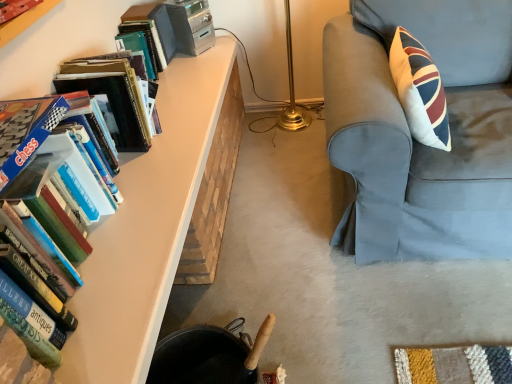
Question: Do you think hardcover books at left, positioned as the 1th book in bottom-to-top order, is within matte plastic bookcase at upper left, or outside of it?

Choices:
 (A) outside
 (B) inside

Answer: (A)

Question: From a real-world perspective, relative to matte plastic bookcase at upper left, is hardcover books at left, positioned as the 1th book in bottom-to-top order, vertically above or below?

Choices:
 (A) above
 (B) below

Answer: (B)

Question: Estimate the real-world distances between objects in this image. Which object is closer to the gold metallic table lamp at center?

Choices:
 (A) matte plastic bookcase at upper left
 (B) hardcover books at left, positioned as the second book in top-to-bottom order
 (C) matte white table at left
 (D) hardcover book at upper left, positioned as the 2th book in bottom-to-top order
 (E) light blue fabric chair at right

Answer: (D)

Question: Considering the real-world distances, which object is farthest from the hardcover book at upper left, which is the first book in top-to-bottom order?

Choices:
 (A) matte plastic bookcase at upper left
 (B) hardcover books at left, which appears as the 2th book when viewed from the back
 (C) gold metallic table lamp at center
 (D) light blue fabric chair at right
 (E) matte white table at left

Answer: (D)